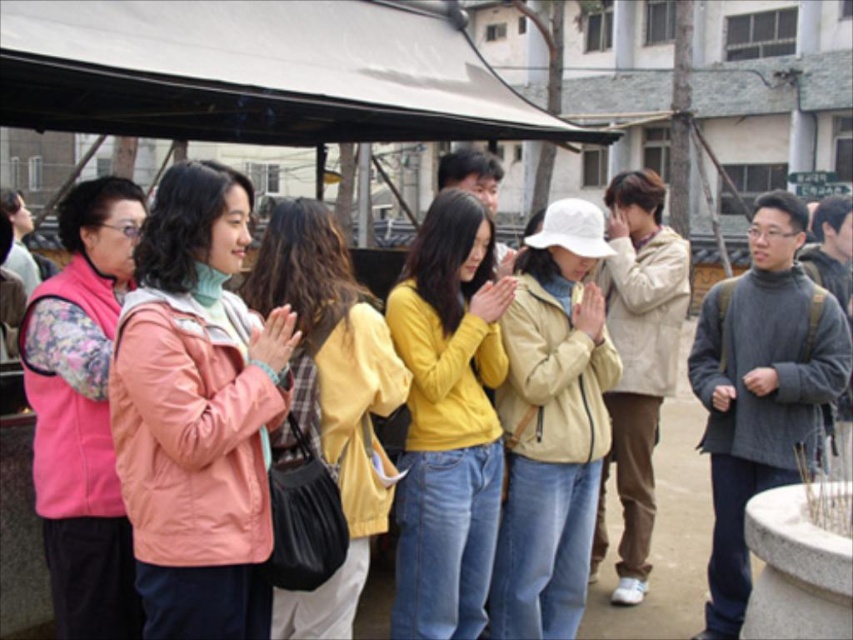
Question: Which of the following is the closest to the observer?

Choices:
 (A) pink velvety vest at left
 (B) peach matte jacket at center
 (C) white matte canopy at upper center

Answer: (B)

Question: Which object is the farthest from the pink velvety vest at left?

Choices:
 (A) beige matte jacket at center
 (B) pink fabric jacket at center
 (C) peach matte jacket at center
 (D) yellow matte sweater at center

Answer: (A)

Question: Among these points, which one is nearest to the camera?

Choices:
 (A) (78, 442)
 (B) (167, 38)

Answer: (A)

Question: Does peach matte jacket at center lie behind pink velvety vest at left?

Choices:
 (A) no
 (B) yes

Answer: (A)

Question: Can you confirm if white matte canopy at upper center is smaller than pink velvety vest at left?

Choices:
 (A) no
 (B) yes

Answer: (A)

Question: Does peach matte jacket at center appear on the right side of yellow matte sweater at center?

Choices:
 (A) no
 (B) yes

Answer: (A)